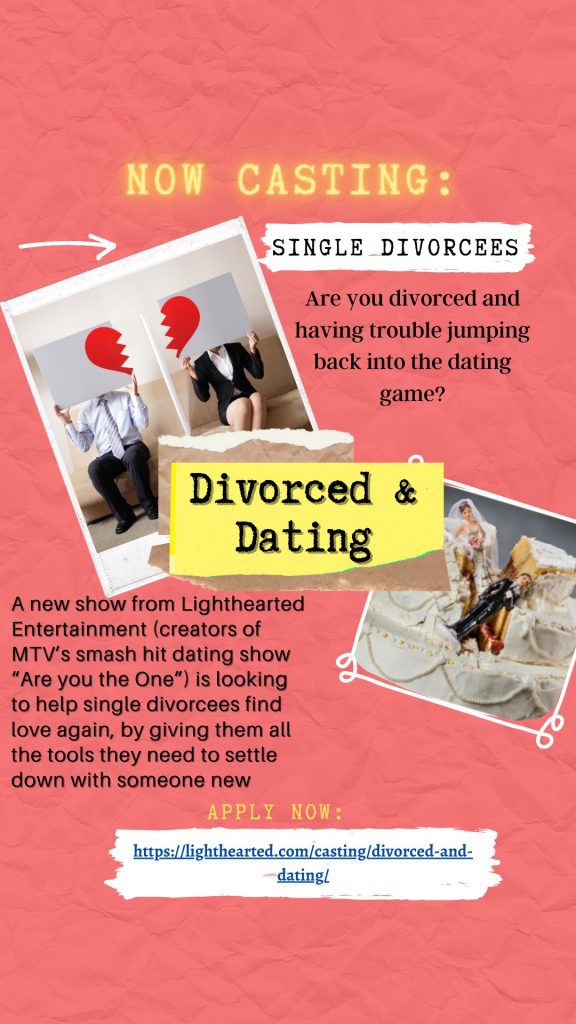
I want to click on photographs, so tap(94, 275), tap(520, 511).